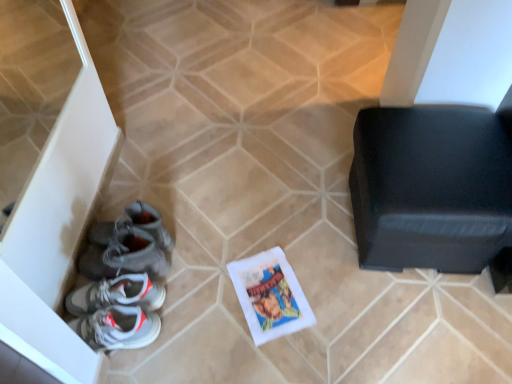
Identify the location of free space to the back side of gray suede sneakers at lower left. This screenshot has width=512, height=384. 148,197.